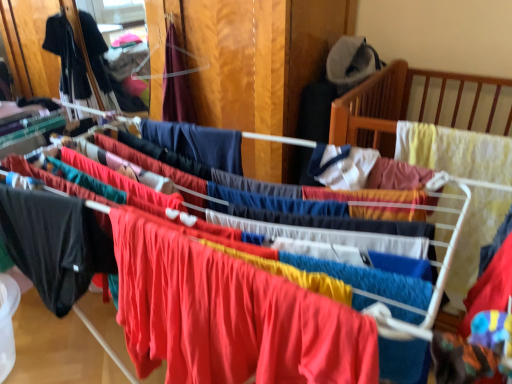
The image size is (512, 384). What do you see at coordinates (228, 315) in the screenshot?
I see `matte red fabric at center, positioned as the 4th clothing in back-to-front order` at bounding box center [228, 315].

This screenshot has height=384, width=512. Describe the element at coordinates (176, 84) in the screenshot. I see `velvet burgundy dress at upper center, the 2th clothing viewed from the back` at that location.

I want to click on black fabric shirt at left, which is the 4th clothing in right-to-left order, so click(x=68, y=61).

Find the location of `matte red fabric at center, the 1th clothing in the right-to-left sequence`. matte red fabric at center, the 1th clothing in the right-to-left sequence is located at coordinates (228, 315).

Does matte red fabric at center, the 1th clothing in the right-to-left sequence, appear on the right side of velvet burgundy dress at upper center, which is counted as the third clothing, starting from the left?

Yes, matte red fabric at center, the 1th clothing in the right-to-left sequence, is to the right of velvet burgundy dress at upper center, which is counted as the third clothing, starting from the left.

Is matte red fabric at center, positioned as the 4th clothing in back-to-front order, turned away from velvet burgundy dress at upper center, placed as the 3th clothing when sorted from front to back?

matte red fabric at center, positioned as the 4th clothing in back-to-front order, is not turned away from velvet burgundy dress at upper center, placed as the 3th clothing when sorted from front to back.

From the image's perspective, between matte red fabric at center, which is counted as the fourth clothing, starting from the left, and velvet burgundy dress at upper center, the 2th clothing in the right-to-left sequence, who is located below?

matte red fabric at center, which is counted as the fourth clothing, starting from the left.

In terms of height, does matte red fabric at center, which is counted as the fourth clothing, starting from the left, look taller or shorter compared to velvet burgundy dress at upper center, the 2th clothing viewed from the back?

Considering their sizes, matte red fabric at center, which is counted as the fourth clothing, starting from the left, has less height than velvet burgundy dress at upper center, the 2th clothing viewed from the back.

From a real-world perspective, which object stands above the other?

In real-world perspective, velvet burgundy dress at upper center, the 2th clothing viewed from the back, is above.

Between point (45, 194) and point (167, 120), which one is positioned behind?

The point (167, 120) is behind.

Can you confirm if black matte pants at left, the 2th clothing viewed from the left, is taller than velvet burgundy dress at upper center, the 2th clothing in the right-to-left sequence?

In fact, black matte pants at left, the 2th clothing viewed from the left, may be shorter than velvet burgundy dress at upper center, the 2th clothing in the right-to-left sequence.

Is black matte pants at left, acting as the 2th clothing starting from the front, far from velvet burgundy dress at upper center, the 2th clothing in the right-to-left sequence?

That's not correct — black matte pants at left, acting as the 2th clothing starting from the front, is a little close to velvet burgundy dress at upper center, the 2th clothing in the right-to-left sequence.

Is black matte pants at left, acting as the 2th clothing starting from the front, further to the viewer compared to matte red fabric at center, which is counted as the fourth clothing, starting from the left?

Yes, the depth of black matte pants at left, acting as the 2th clothing starting from the front, is greater than that of matte red fabric at center, which is counted as the fourth clothing, starting from the left.

Considering the positions of objects black matte pants at left, the 3th clothing from the right, and matte red fabric at center, positioned as the 4th clothing in back-to-front order, in the image provided, who is more to the right, black matte pants at left, the 3th clothing from the right, or matte red fabric at center, positioned as the 4th clothing in back-to-front order,?

From the viewer's perspective, matte red fabric at center, positioned as the 4th clothing in back-to-front order, appears more on the right side.

What's the angular difference between black matte pants at left, which is the 3th clothing in back-to-front order, and matte red fabric at center, the 1th clothing viewed from the front,'s facing directions?

There is a 3-degree angle between the facing directions of black matte pants at left, which is the 3th clothing in back-to-front order, and matte red fabric at center, the 1th clothing viewed from the front.

Considering the positions of points (73, 265) and (270, 316), is point (73, 265) closer to camera compared to point (270, 316)?

No, it is behind (270, 316).

Looking at this image, does black fabric shirt at left, marked as the first clothing in a left-to-right arrangement, have a greater height compared to black matte pants at left, the 3th clothing from the right?

Yes.

Is black fabric shirt at left, which is the 4th clothing in right-to-left order, turned away from black matte pants at left, acting as the 2th clothing starting from the front?

No, black fabric shirt at left, which is the 4th clothing in right-to-left order, is not facing away from black matte pants at left, acting as the 2th clothing starting from the front.

Between black fabric shirt at left, which is the 4th clothing in right-to-left order, and black matte pants at left, the 3th clothing from the right, which one has larger size?

black fabric shirt at left, which is the 4th clothing in right-to-left order, is bigger.

Choose the correct answer: Is matte red fabric at center, the 1th clothing viewed from the front, inside black fabric shirt at left, which is the 4th clothing in right-to-left order, or outside it?

matte red fabric at center, the 1th clothing viewed from the front, cannot be found inside black fabric shirt at left, which is the 4th clothing in right-to-left order.

I want to click on the 3rd clothing to the left when counting from the matte red fabric at center, the 1th clothing viewed from the front, so click(x=68, y=61).

Considering the sizes of objects matte red fabric at center, the 1th clothing viewed from the front, and black fabric shirt at left, the fourth clothing in the front-to-back sequence, in the image provided, who is thinner, matte red fabric at center, the 1th clothing viewed from the front, or black fabric shirt at left, the fourth clothing in the front-to-back sequence,?

matte red fabric at center, the 1th clothing viewed from the front.

Is matte red fabric at center, the 1th clothing in the right-to-left sequence, to the left of black fabric shirt at left, marked as the first clothing in a left-to-right arrangement, from the viewer's perspective?

No, matte red fabric at center, the 1th clothing in the right-to-left sequence, is not to the left of black fabric shirt at left, marked as the first clothing in a left-to-right arrangement.

Between matte red fabric at center, which is counted as the fourth clothing, starting from the left, and black matte pants at left, the 3th clothing from the right, which one appears on the left side from the viewer's perspective?

From the viewer's perspective, black matte pants at left, the 3th clothing from the right, appears more on the left side.

Could you tell me if matte red fabric at center, which is counted as the fourth clothing, starting from the left, is facing black matte pants at left, acting as the 2th clothing starting from the front?

No, matte red fabric at center, which is counted as the fourth clothing, starting from the left, is not aimed at black matte pants at left, acting as the 2th clothing starting from the front.

The image size is (512, 384). What are the coordinates of `clothing that appears in front of the black matte pants at left, the 2th clothing viewed from the left` in the screenshot? It's located at (228, 315).

Is point (206, 287) farther from camera compared to point (47, 236)?

No.

Is velvet burgundy dress at upper center, the 2th clothing viewed from the back, to the right of black matte pants at left, the 3th clothing from the right, from the viewer's perspective?

Yes, velvet burgundy dress at upper center, the 2th clothing viewed from the back, is to the right of black matte pants at left, the 3th clothing from the right.

In the scene shown: Which of these two, velvet burgundy dress at upper center, placed as the 3th clothing when sorted from front to back, or black matte pants at left, the 2th clothing viewed from the left, is thinner?

black matte pants at left, the 2th clothing viewed from the left.

Can you confirm if velvet burgundy dress at upper center, placed as the 3th clothing when sorted from front to back, is shorter than black matte pants at left, which is the 3th clothing in back-to-front order?

In fact, velvet burgundy dress at upper center, placed as the 3th clothing when sorted from front to back, may be taller than black matte pants at left, which is the 3th clothing in back-to-front order.

Are velvet burgundy dress at upper center, the 2th clothing viewed from the back, and black matte pants at left, which is the 3th clothing in back-to-front order, far apart?

No.

Where is `the 3rd clothing positioned below the velvet burgundy dress at upper center, placed as the 3th clothing when sorted from front to back (from a real-world perspective)`? The width and height of the screenshot is (512, 384). the 3rd clothing positioned below the velvet burgundy dress at upper center, placed as the 3th clothing when sorted from front to back (from a real-world perspective) is located at coordinates (228, 315).

At what (x,y) coordinates should I click in order to perform the action: click on clothing that is the 1st object located behind the black matte pants at left, the 2th clothing viewed from the left. Please return your answer as a coordinate pair (x, y). The width and height of the screenshot is (512, 384). Looking at the image, I should click on (176, 84).

Estimate the real-world distances between objects in this image. Which object is further from black fabric shirt at left, marked as the first clothing in a left-to-right arrangement, black matte pants at left, acting as the 2th clothing starting from the front, or velvet burgundy dress at upper center, placed as the 3th clothing when sorted from front to back?

black matte pants at left, acting as the 2th clothing starting from the front, is further to black fabric shirt at left, marked as the first clothing in a left-to-right arrangement.

Based on their spatial positions, is velvet burgundy dress at upper center, which is counted as the third clothing, starting from the left, or black fabric shirt at left, marked as the first clothing in a left-to-right arrangement, further from matte red fabric at center, the 1th clothing viewed from the front?

black fabric shirt at left, marked as the first clothing in a left-to-right arrangement, is positioned further to the anchor matte red fabric at center, the 1th clothing viewed from the front.

From the image, which object appears to be nearer to black matte pants at left, acting as the 2th clothing starting from the front, matte red fabric at center, which is counted as the fourth clothing, starting from the left, or velvet burgundy dress at upper center, the 2th clothing in the right-to-left sequence?

Among the two, matte red fabric at center, which is counted as the fourth clothing, starting from the left, is located nearer to black matte pants at left, acting as the 2th clothing starting from the front.

Considering their positions, is black fabric shirt at left, marked as the first clothing in a left-to-right arrangement, positioned further to velvet burgundy dress at upper center, the 2th clothing in the right-to-left sequence, than black matte pants at left, acting as the 2th clothing starting from the front?

black matte pants at left, acting as the 2th clothing starting from the front, lies further to velvet burgundy dress at upper center, the 2th clothing in the right-to-left sequence, than the other object.

When comparing their distances from matte red fabric at center, which is counted as the fourth clothing, starting from the left, does black fabric shirt at left, which is the 4th clothing in right-to-left order, or black matte pants at left, which is the 3th clothing in back-to-front order, seem further?

Among the two, black fabric shirt at left, which is the 4th clothing in right-to-left order, is located further to matte red fabric at center, which is counted as the fourth clothing, starting from the left.

From the image, which object appears to be farther from matte red fabric at center, the 1th clothing viewed from the front, black fabric shirt at left, which is the 4th clothing in right-to-left order, or velvet burgundy dress at upper center, the 2th clothing viewed from the back?

black fabric shirt at left, which is the 4th clothing in right-to-left order, is further to matte red fabric at center, the 1th clothing viewed from the front.

In the scene shown: Looking at the image, which one is located further to matte red fabric at center, the 1th clothing in the right-to-left sequence, black matte pants at left, acting as the 2th clothing starting from the front, or velvet burgundy dress at upper center, the 2th clothing in the right-to-left sequence?

Among the two, velvet burgundy dress at upper center, the 2th clothing in the right-to-left sequence, is located further to matte red fabric at center, the 1th clothing in the right-to-left sequence.

When comparing their distances from velvet burgundy dress at upper center, which is counted as the third clothing, starting from the left, does black matte pants at left, which is the 3th clothing in back-to-front order, or black fabric shirt at left, marked as the first clothing in a left-to-right arrangement, seem closer?

black fabric shirt at left, marked as the first clothing in a left-to-right arrangement, lies closer to velvet burgundy dress at upper center, which is counted as the third clothing, starting from the left, than the other object.

This screenshot has height=384, width=512. Identify the location of clothing between black matte pants at left, the 3th clothing from the right, and black fabric shirt at left, which is the 4th clothing in right-to-left order, from front to back. (176, 84).

This screenshot has width=512, height=384. Find the location of `clothing positioned between matte red fabric at center, the 1th clothing in the right-to-left sequence, and velvet burgundy dress at upper center, which is counted as the third clothing, starting from the left, from near to far`. clothing positioned between matte red fabric at center, the 1th clothing in the right-to-left sequence, and velvet burgundy dress at upper center, which is counted as the third clothing, starting from the left, from near to far is located at coordinates (54, 244).